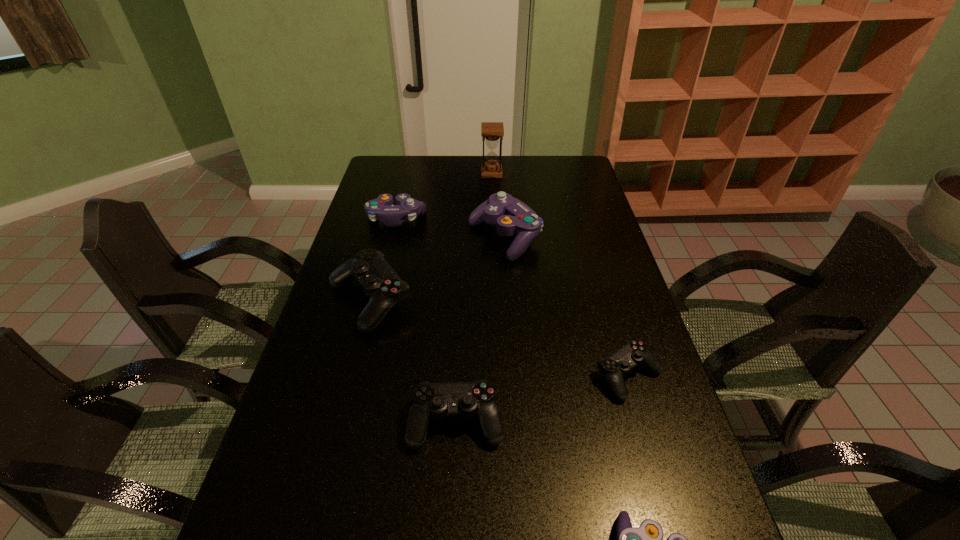
Find the location of a particular element. The width and height of the screenshot is (960, 540). the second closest black control relative to the second smallest purple control is located at coordinates pyautogui.click(x=477, y=398).